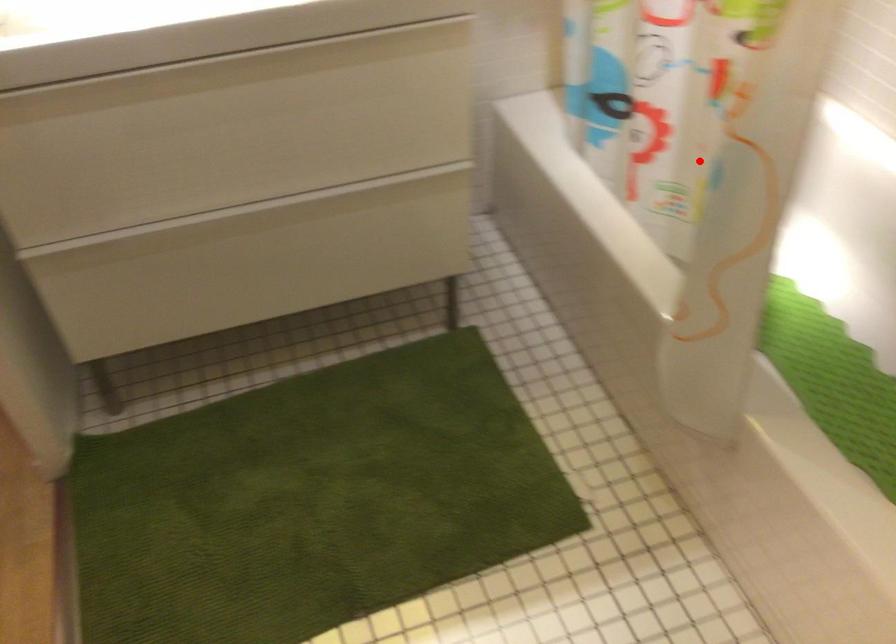
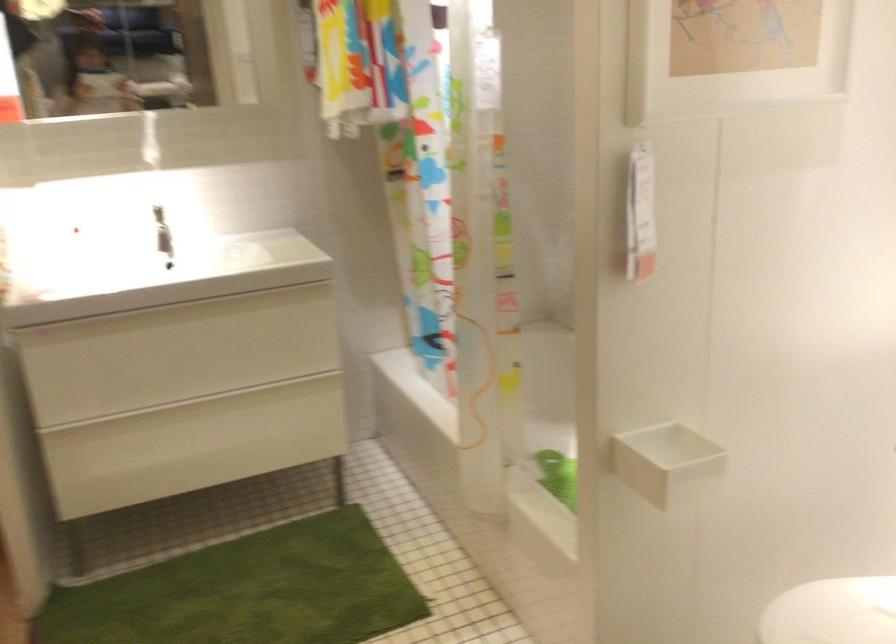
Question: I am providing you with two images of the same scene from different viewpoints. Given a red point in image1, look at the same physical point in image2. Is it:

Choices:
 (A) Closer to the viewpoint
 (B) Farther from the viewpoint

Answer: (B)